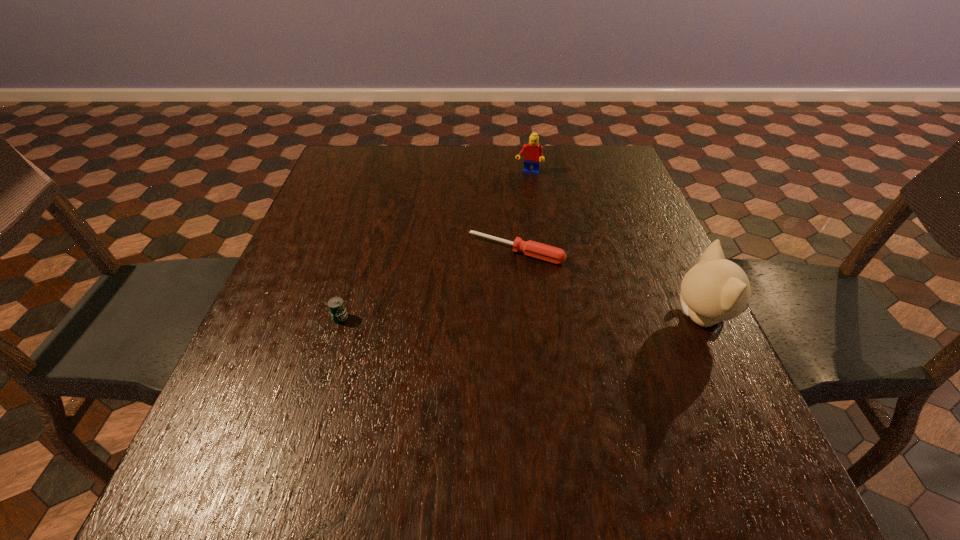
Where is `the leftmost object`? Image resolution: width=960 pixels, height=540 pixels. the leftmost object is located at coordinates (336, 306).

At what (x,y) coordinates should I click in order to perform the action: click on the second shortest object. Please return your answer as a coordinate pair (x, y). Looking at the image, I should click on (336, 306).

You are a GUI agent. You are given a task and a screenshot of the screen. Output one action in this format:
    pyautogui.click(x=<x>, y=<y>)
    Task: Click on the tallest object
    
    Given the screenshot: What is the action you would take?
    pyautogui.click(x=716, y=289)

This screenshot has width=960, height=540. What are the coordinates of `kitten` in the screenshot? It's located at (716, 289).

At what (x,y) coordinates should I click in order to perform the action: click on Lego. Please return your answer as a coordinate pair (x, y). The width and height of the screenshot is (960, 540). Looking at the image, I should click on (534, 152).

Where is `the farthest object`? The image size is (960, 540). the farthest object is located at coordinates (534, 152).

You are a GUI agent. You are given a task and a screenshot of the screen. Output one action in this format:
    pyautogui.click(x=<x>, y=<y>)
    Task: Click on the screwdriver
    The image size is (960, 540).
    Given the screenshot: What is the action you would take?
    544,252

This screenshot has height=540, width=960. I want to click on the third nearest object, so click(x=544, y=252).

In order to click on vacant position located on the back of the beer can in this screenshot , I will do `click(352, 279)`.

You are a GUI agent. You are given a task and a screenshot of the screen. Output one action in this format:
    pyautogui.click(x=<x>, y=<y>)
    Task: Click on the free point located 0.260m on the front-facing side of the Lego
    The width and height of the screenshot is (960, 540).
    Given the screenshot: What is the action you would take?
    pyautogui.click(x=510, y=232)